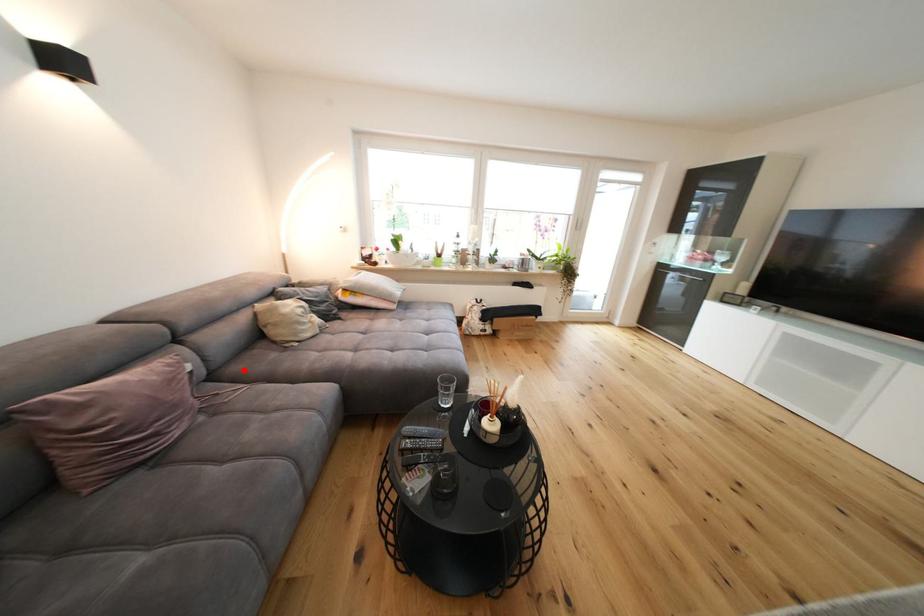
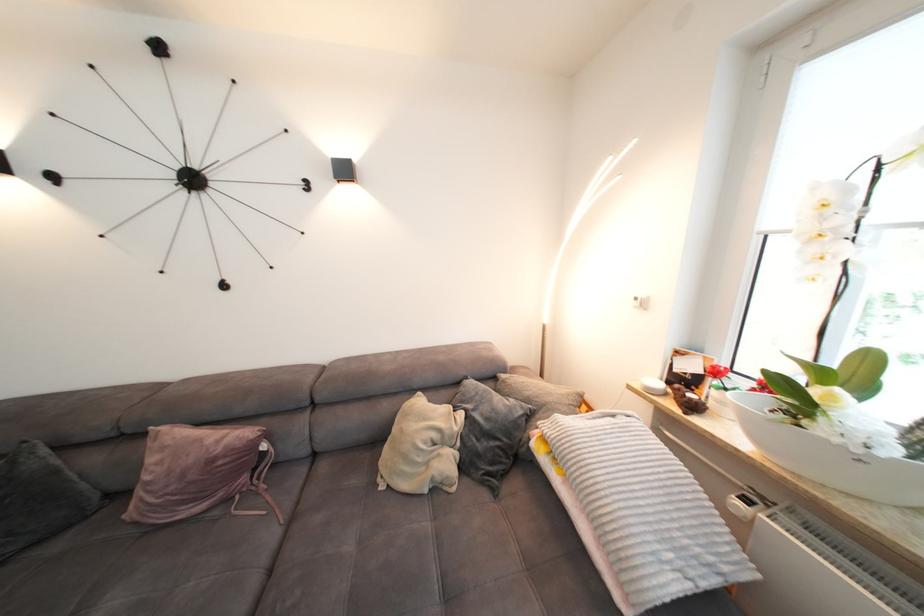
Question: I am providing you with two images of the same scene from different viewpoints. In image1, a red point is highlighted. Considering the same 3D point in image2, which of the following is correct?

Choices:
 (A) It is closer
 (B) It is farther

Answer: (B)